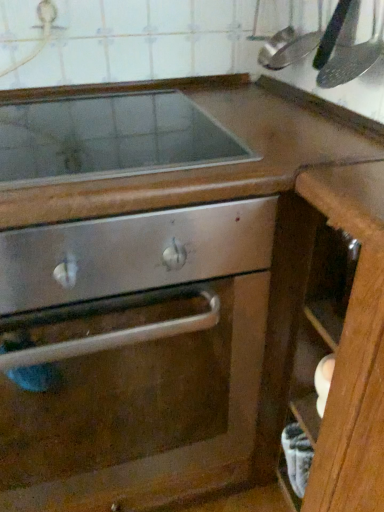
The image size is (384, 512). Describe the element at coordinates (47, 17) in the screenshot. I see `brushed metal faucet at upper left` at that location.

Identify the location of wooden drawer at lower right. The width and height of the screenshot is (384, 512). (331, 282).

This screenshot has width=384, height=512. What do you see at coordinates (141, 417) in the screenshot?
I see `stainless steel oven door at center` at bounding box center [141, 417].

The image size is (384, 512). Describe the element at coordinates (354, 55) in the screenshot. I see `metallic silver spatula at upper right` at that location.

The width and height of the screenshot is (384, 512). What are the coordinates of `smooth stainless steel cooktop at upper center` in the screenshot? It's located at (109, 138).

Is brushed metal faucet at upper left with metallic silver spatula at upper right?

They are not placed beside each other.

Is brushed metal faucet at upper left oriented towards metallic silver spatula at upper right?

No, brushed metal faucet at upper left is not facing towards metallic silver spatula at upper right.

From the image's perspective, is brushed metal faucet at upper left above or below metallic silver spatula at upper right?

Clearly, from the image's perspective, brushed metal faucet at upper left is above metallic silver spatula at upper right.

Considering the relative sizes of brushed metal faucet at upper left and metallic silver spatula at upper right in the image provided, is brushed metal faucet at upper left shorter than metallic silver spatula at upper right?

Yes, brushed metal faucet at upper left is shorter than metallic silver spatula at upper right.

From a real-world perspective, who is located higher, metallic silver spatula at upper right or stainless steel oven door at center?

From a 3D spatial view, metallic silver spatula at upper right is above.

Is metallic silver spatula at upper right inside or outside of stainless steel oven door at center?

metallic silver spatula at upper right is outside stainless steel oven door at center.

Is metallic silver spatula at upper right bigger than stainless steel oven door at center?

Actually, metallic silver spatula at upper right might be smaller than stainless steel oven door at center.

Which is farther, (329, 282) or (73, 166)?

Positioned behind is point (329, 282).

Is wooden drawer at lower right aimed at smooth stainless steel cooktop at upper center?

No, wooden drawer at lower right is not turned towards smooth stainless steel cooktop at upper center.

In terms of height, does wooden drawer at lower right look taller or shorter compared to smooth stainless steel cooktop at upper center?

Considering their sizes, wooden drawer at lower right has more height than smooth stainless steel cooktop at upper center.

Where is `gas stove on the left of wooden drawer at lower right`? The width and height of the screenshot is (384, 512). gas stove on the left of wooden drawer at lower right is located at coordinates tap(109, 138).

How distant is stainless steel oven door at center from metallic silver spatula at upper right?

27.25 inches.

From the picture: Looking at their sizes, would you say stainless steel oven door at center is wider or thinner than metallic silver spatula at upper right?

stainless steel oven door at center is wider than metallic silver spatula at upper right.

In terms of height, does stainless steel oven door at center look taller or shorter compared to metallic silver spatula at upper right?

Considering their sizes, stainless steel oven door at center has more height than metallic silver spatula at upper right.

Could you measure the distance between stainless steel oven door at center and smooth stainless steel cooktop at upper center?

stainless steel oven door at center is 16.44 inches from smooth stainless steel cooktop at upper center.

From a real-world perspective, which object stands above the other?

smooth stainless steel cooktop at upper center.

Is the position of stainless steel oven door at center less distant than that of smooth stainless steel cooktop at upper center?

That is True.

From the image's perspective, which is above, stainless steel oven door at center or smooth stainless steel cooktop at upper center?

smooth stainless steel cooktop at upper center, from the image's perspective.

How different are the orientations of wooden drawer at lower right and metallic silver spatula at upper right in degrees?

The angular difference between wooden drawer at lower right and metallic silver spatula at upper right is 1.15 degrees.

Is point (331, 311) more distant than point (376, 54)?

Yes, it is.

Between wooden drawer at lower right and metallic silver spatula at upper right, which one has smaller size?

With smaller size is metallic silver spatula at upper right.

Is wooden drawer at lower right facing away from metallic silver spatula at upper right?

No, wooden drawer at lower right is not facing the opposite direction of metallic silver spatula at upper right.

Does smooth stainless steel cooktop at upper center have a lesser width compared to brushed metal faucet at upper left?

No.

From the image's perspective, is smooth stainless steel cooktop at upper center positioned above or below brushed metal faucet at upper left?

smooth stainless steel cooktop at upper center is situated lower than brushed metal faucet at upper left in the image.

Does point (32, 162) come closer to viewer compared to point (41, 13)?

That is True.

Could you measure the distance between smooth stainless steel cooktop at upper center and brushed metal faucet at upper left?

A distance of 15.51 inches exists between smooth stainless steel cooktop at upper center and brushed metal faucet at upper left.

In order to click on faucet behind the metallic silver spatula at upper right in this screenshot , I will do `click(47, 17)`.

Where is `kitchen appliance above the stainless steel oven door at center (from a real-world perspective)`? The image size is (384, 512). kitchen appliance above the stainless steel oven door at center (from a real-world perspective) is located at coordinates (354, 55).

When comparing their distances from wooden drawer at lower right, does brushed metal faucet at upper left or smooth stainless steel cooktop at upper center seem closer?

smooth stainless steel cooktop at upper center.

Based on their spatial positions, is wooden drawer at lower right or metallic silver spatula at upper right closer to stainless steel oven door at center?

wooden drawer at lower right is positioned closer to the anchor stainless steel oven door at center.

Looking at the image, which one is located closer to wooden drawer at lower right, brushed metal faucet at upper left or metallic silver spatula at upper right?

The object closer to wooden drawer at lower right is metallic silver spatula at upper right.

When comparing their distances from stainless steel oven door at center, does brushed metal faucet at upper left or metallic silver spatula at upper right seem closer?

Based on the image, metallic silver spatula at upper right appears to be nearer to stainless steel oven door at center.

Considering their positions, is smooth stainless steel cooktop at upper center positioned closer to brushed metal faucet at upper left than stainless steel oven door at center?

smooth stainless steel cooktop at upper center.

From the image, which object appears to be nearer to metallic silver spatula at upper right, smooth stainless steel cooktop at upper center or stainless steel oven door at center?

Among the two, smooth stainless steel cooktop at upper center is located nearer to metallic silver spatula at upper right.

Based on their spatial positions, is smooth stainless steel cooktop at upper center or wooden drawer at lower right further from metallic silver spatula at upper right?

Based on the image, smooth stainless steel cooktop at upper center appears to be further to metallic silver spatula at upper right.

When comparing their distances from wooden drawer at lower right, does stainless steel oven door at center or smooth stainless steel cooktop at upper center seem further?

smooth stainless steel cooktop at upper center.

You are a GUI agent. You are given a task and a screenshot of the screen. Output one action in this format:
    pyautogui.click(x=<x>, y=<y>)
    Task: Click on the gas stove between brushed metal faucet at upper left and wooden drawer at lower right in the horizontal direction
    
    Given the screenshot: What is the action you would take?
    pyautogui.click(x=109, y=138)

The width and height of the screenshot is (384, 512). Identify the location of kitchen appliance between brushed metal faucet at upper left and wooden drawer at lower right from left to right. (354, 55).

Locate an element on the screen. The image size is (384, 512). gas stove located between stainless steel oven door at center and metallic silver spatula at upper right in the left-right direction is located at coordinates (109, 138).

Locate an element on the screen. drawer between brushed metal faucet at upper left and stainless steel oven door at center vertically is located at coordinates (331, 282).